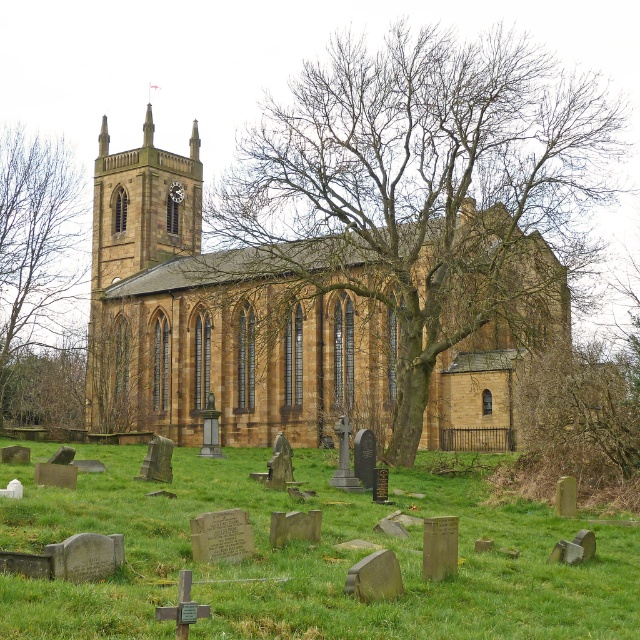
Consider the image. You are standing in the graveyard and want to determine the relative heights of the green grass at lower center and the brown stone clock tower at upper left. Which one is taller?

The brown stone clock tower at upper left is taller than the green grass at lower center.

You are standing at the entrance of the church and want to find the bare branches at center. According to the coordinates provided, in which direction should you look to locate them?

The bare branches at center are located at coordinates point (x=426, y=186), so you should look towards the center of the image to find them.